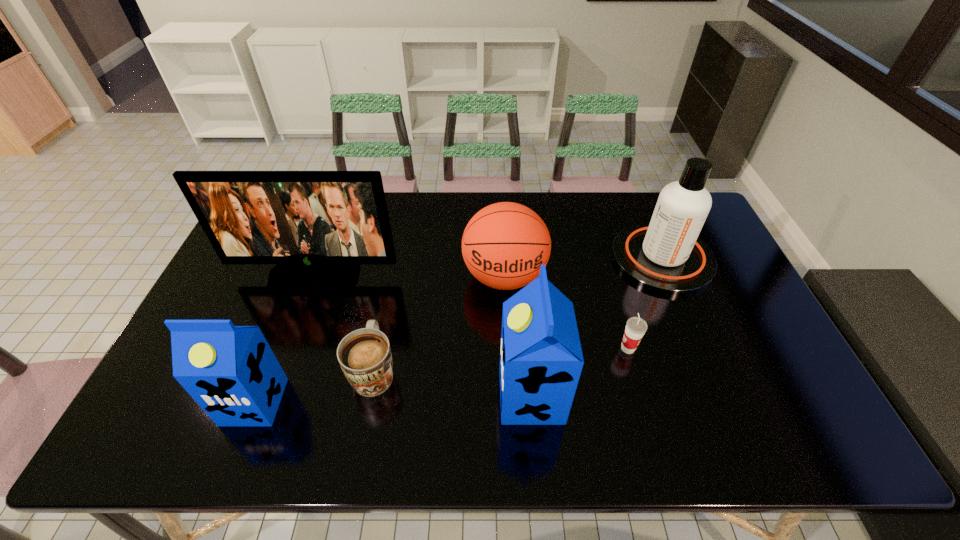
At what (x,y) coordinates should I click in order to perform the action: click on mug that is at the near edge. Please return your answer as a coordinate pair (x, y). Looking at the image, I should click on (364, 355).

Where is `object that is at the left edge`? The image size is (960, 540). object that is at the left edge is located at coordinates (317, 226).

You are a GUI agent. You are given a task and a screenshot of the screen. Output one action in this format:
    pyautogui.click(x=<x>, y=<y>)
    Task: Click on the object situated at the right edge
    
    Given the screenshot: What is the action you would take?
    pyautogui.click(x=666, y=256)

The width and height of the screenshot is (960, 540). Find the location of `object that is at the far right corner`. object that is at the far right corner is located at coordinates (666, 256).

This screenshot has width=960, height=540. Find the location of `vacant space at the far edge of the desktop`. vacant space at the far edge of the desktop is located at coordinates (468, 222).

Where is `free region at the near edge of the desktop`? The image size is (960, 540). free region at the near edge of the desktop is located at coordinates (616, 408).

Image resolution: width=960 pixels, height=540 pixels. In the image, there is a desktop. Find the location of `vacant space at the right edge`. vacant space at the right edge is located at coordinates (718, 323).

The width and height of the screenshot is (960, 540). I want to click on empty space between the basketball and the monitor, so click(x=410, y=276).

Where is `vacant region between the cleansing agent and the taller carton`? vacant region between the cleansing agent and the taller carton is located at coordinates click(596, 327).

The image size is (960, 540). I want to click on vacant space that's between the cleansing agent and the basketball, so click(584, 268).